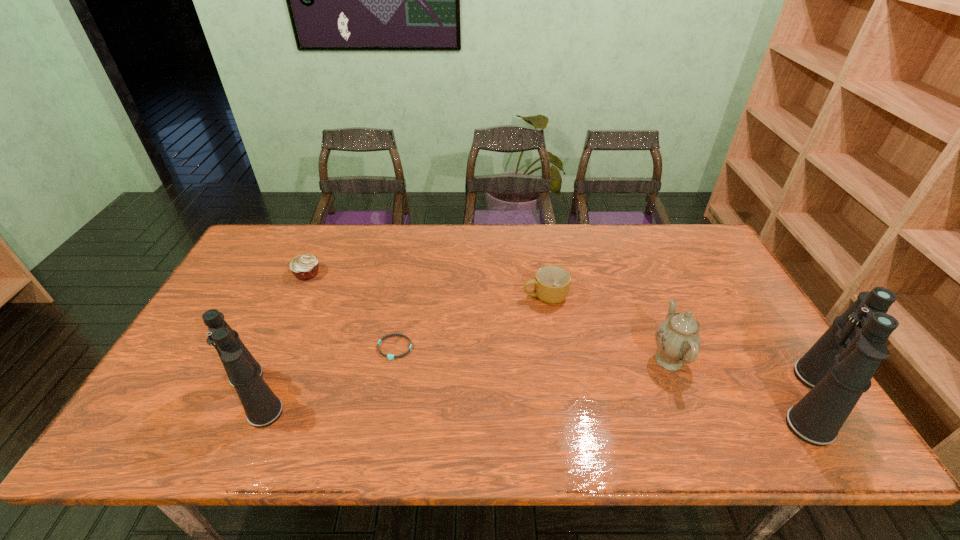
At what (x,y) coordinates should I click in order to perform the action: click on vacant space located on the side with the handle of the mug. Please return your answer as a coordinate pair (x, y). Looking at the image, I should click on (439, 296).

Where is `object at the far edge`? Image resolution: width=960 pixels, height=540 pixels. object at the far edge is located at coordinates (304, 267).

What are the coordinates of `chinaware at the near edge` in the screenshot? It's located at (678, 340).

The width and height of the screenshot is (960, 540). What are the coordinates of `object located in the left edge section of the desktop` in the screenshot? It's located at (262, 407).

Identify the location of object that is at the right edge. (838, 368).

Identify the location of object that is at the near left corner. (262, 407).

At what (x,y) coordinates should I click in order to perform the action: click on object that is at the near right corner. Please return your answer as a coordinate pair (x, y). The height and width of the screenshot is (540, 960). Looking at the image, I should click on (838, 368).

Locate an element on the screen. Image resolution: width=960 pixels, height=540 pixels. vacant space at the far edge is located at coordinates (621, 248).

Image resolution: width=960 pixels, height=540 pixels. In order to click on vacant point at the near edge in this screenshot , I will do `click(230, 396)`.

In the image, there is a desktop. Where is `vacant region at the left edge`? This screenshot has height=540, width=960. vacant region at the left edge is located at coordinates (250, 273).